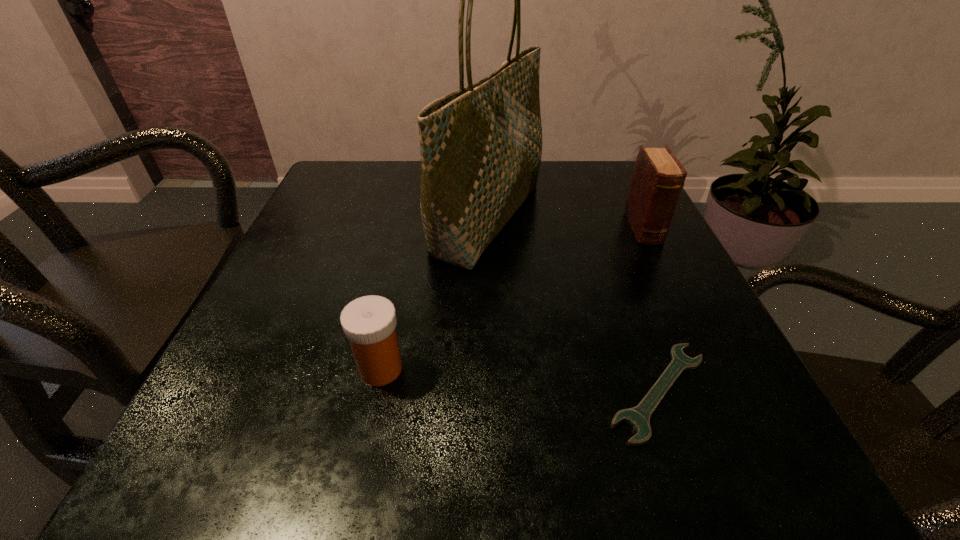
Find the location of a particular element. The width and height of the screenshot is (960, 540). vacant area between the shopping bag and the wrench is located at coordinates (574, 305).

Find the location of `free spot between the second shortest object and the tallest object`. free spot between the second shortest object and the tallest object is located at coordinates (434, 293).

Locate an element on the screen. This screenshot has height=540, width=960. object identified as the third closest to the leftmost object is located at coordinates (658, 177).

This screenshot has height=540, width=960. Identify the location of the third closest object to the second tallest object. (369, 322).

You are a GUI agent. You are given a task and a screenshot of the screen. Output one action in this format:
    pyautogui.click(x=<x>, y=<y>)
    Task: Click on the vacant area that satisfies the following two spatial constraints: 1. on the back side of the medicine; 2. on the left side of the shopping bag
    The height and width of the screenshot is (540, 960).
    Given the screenshot: What is the action you would take?
    click(412, 218)

I want to click on free space that satisfies the following two spatial constraints: 1. on the front side of the shortest object; 2. on the right side of the third object from right to left, so click(492, 392).